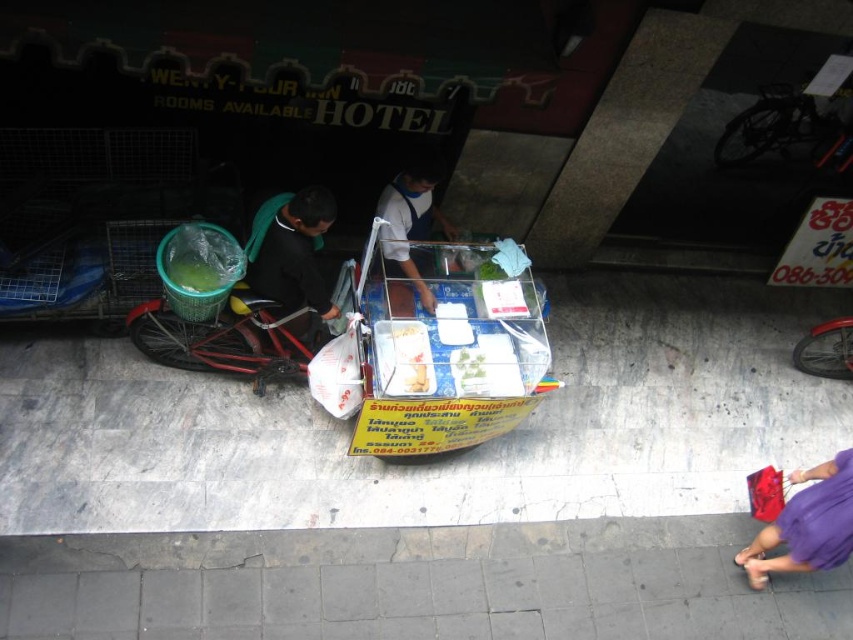
Is smooth concrete pavement at center to the left of purple fabric bag at lower right from the viewer's perspective?

Correct, you'll find smooth concrete pavement at center to the left of purple fabric bag at lower right.

Does smooth concrete pavement at center appear under purple fabric bag at lower right?

Incorrect, smooth concrete pavement at center is not positioned below purple fabric bag at lower right.

Identify the location of smooth concrete pavement at center. This screenshot has height=640, width=853. (442, 465).

Between gray concrete pavement at lower center and purple fabric bag at lower right, which one is positioned higher?

Positioned higher is purple fabric bag at lower right.

Does gray concrete pavement at lower center have a lesser width compared to purple fabric bag at lower right?

In fact, gray concrete pavement at lower center might be wider than purple fabric bag at lower right.

Between point (155, 554) and point (833, 518), which one is positioned behind?

The point (155, 554) is behind.

The height and width of the screenshot is (640, 853). In order to click on gray concrete pavement at lower center in this screenshot , I will do `click(415, 584)`.

Does gray concrete pavement at lower center have a smaller size compared to white glossy shirt at center?

No.

Can you confirm if gray concrete pavement at lower center is thinner than white glossy shirt at center?

Incorrect, gray concrete pavement at lower center's width is not less than white glossy shirt at center's.

Who is more distant from viewer, (202, 589) or (440, 224)?

Positioned behind is point (440, 224).

Locate an element on the screen. gray concrete pavement at lower center is located at coordinates (415, 584).